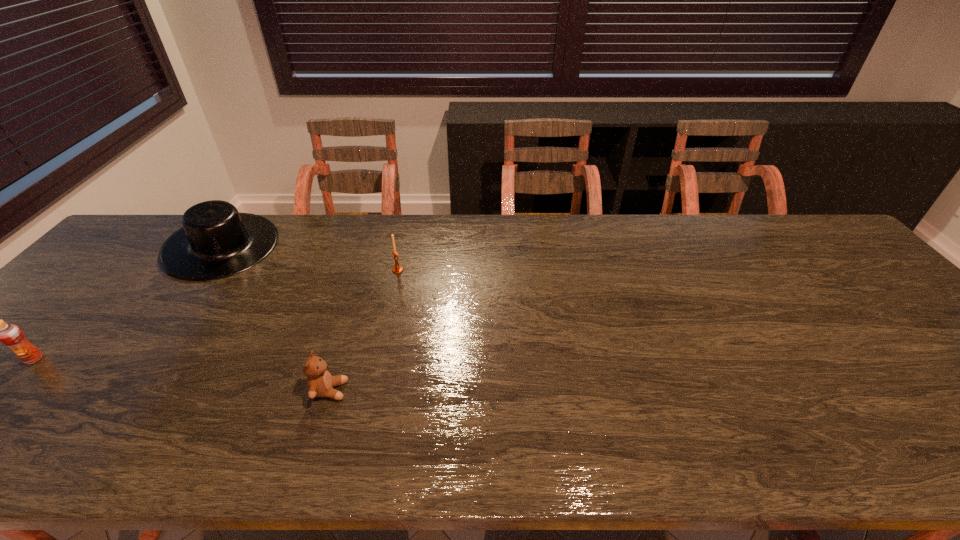
This screenshot has width=960, height=540. What are the coordinates of `free space between the rightmost object and the second object from left to right` in the screenshot? It's located at (310, 258).

Where is `free area in between the second object from left to right and the candle_holder`? The height and width of the screenshot is (540, 960). free area in between the second object from left to right and the candle_holder is located at coordinates (310, 258).

Locate an element on the screen. free space between the teddy bear and the dress hat is located at coordinates (276, 319).

Where is `vacant space that is in between the second object from left to right and the nearest object`? vacant space that is in between the second object from left to right and the nearest object is located at coordinates (276, 319).

Image resolution: width=960 pixels, height=540 pixels. Find the location of `free space that is in between the second object from left to right and the second object from right to left`. free space that is in between the second object from left to right and the second object from right to left is located at coordinates (276, 319).

You are a GUI agent. You are given a task and a screenshot of the screen. Output one action in this format:
    pyautogui.click(x=<x>, y=<y>)
    Task: Click on the unoccupied position between the teddy bear and the rightmost object
    This screenshot has height=540, width=960.
    Given the screenshot: What is the action you would take?
    pyautogui.click(x=364, y=330)

At what (x,y) coordinates should I click in order to perform the action: click on empty location between the third object from right to left and the leftmost object. Please return your answer as a coordinate pair (x, y). The width and height of the screenshot is (960, 540). Looking at the image, I should click on (129, 303).

Choose which object is the nearest neighbor to the second object from left to right. Please provide its 2D coordinates. Your answer should be formatted as a tuple, i.e. [(x, y)], where the tuple contains the x and y coordinates of a point satisfying the conditions above.

[(11, 335)]

Find the location of `object that is the third closest to the dress hat`. object that is the third closest to the dress hat is located at coordinates (320, 383).

This screenshot has height=540, width=960. Find the location of `vacant region that satisfies the following two spatial constraints: 1. on the back side of the leftmost object; 2. on the left side of the dress hat`. vacant region that satisfies the following two spatial constraints: 1. on the back side of the leftmost object; 2. on the left side of the dress hat is located at coordinates (142, 246).